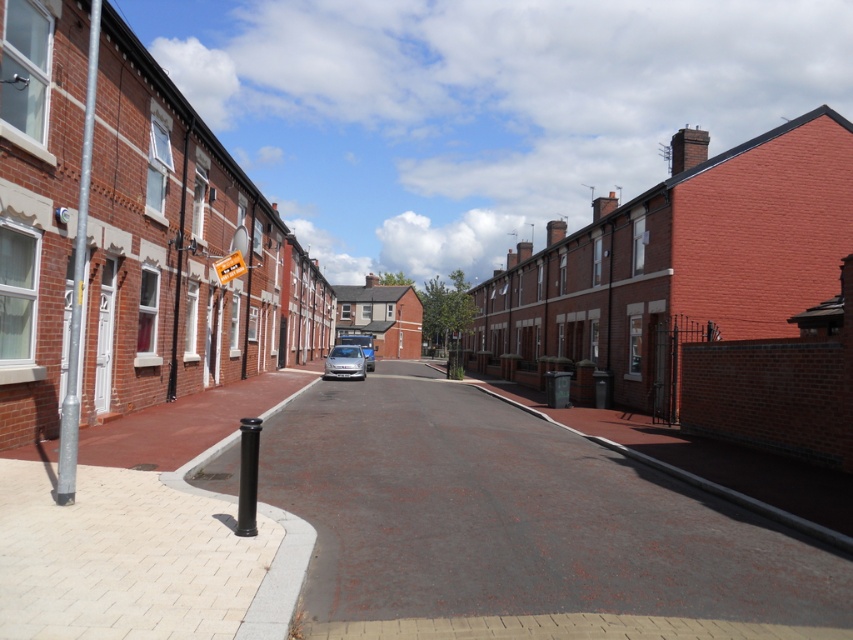
You are standing on the sidewalk and want to place a small potted plant between the smooth asphalt road at center and the yellow plastic street sign at center. According to the scene, which object should the plant be placed closer to?

The smooth asphalt road at center is closer to the viewer than the yellow plastic street sign at center, so the plant should be placed closer to the smooth asphalt road at center.

You are standing on the residential street and want to determine which of the two points, point (349, 368) or point (228, 278), is closer to you. Based on the scene description, which point is nearer?

Point (228, 278) is closer to you because it is less further to the camera than point (349, 368) according to the description.

You are a delivery driver who needs to park your 5.5 meter long truck between the satin silver car at center and the yellow plastic street sign at center. Is there enough space between them for your truck?

The satin silver car at center is 12.26 meters away from the yellow plastic street sign at center. Since your truck is only 5.5 meters long, there is sufficient space between the satin silver car at center and the yellow plastic street sign at center to park your truck.